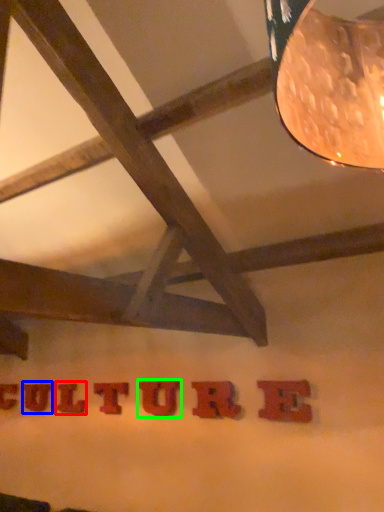
Question: Based on their relative distances, which object is nearer to letter (highlighted by a red box)? Choose from letter (highlighted by a blue box) and letter (highlighted by a green box).

Choices:
 (A) letter
 (B) letter

Answer: (A)